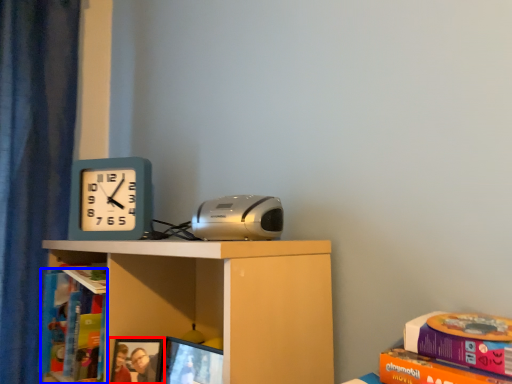
Question: Among these objects, which one is farthest to the camera, picture frame (highlighted by a red box) or book (highlighted by a blue box)?

Choices:
 (A) picture frame
 (B) book

Answer: (B)